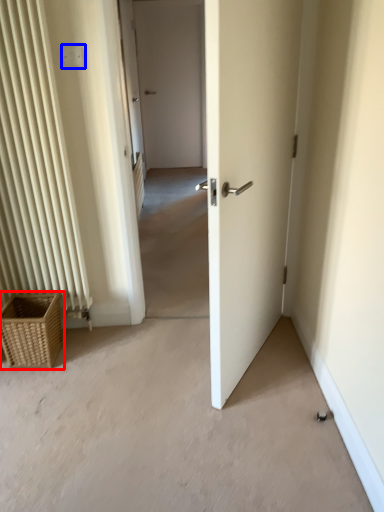
Question: Which object is closer to the camera taking this photo, picnic basket (highlighted by a red box) or electric outlet (highlighted by a blue box)?

Choices:
 (A) picnic basket
 (B) electric outlet

Answer: (B)